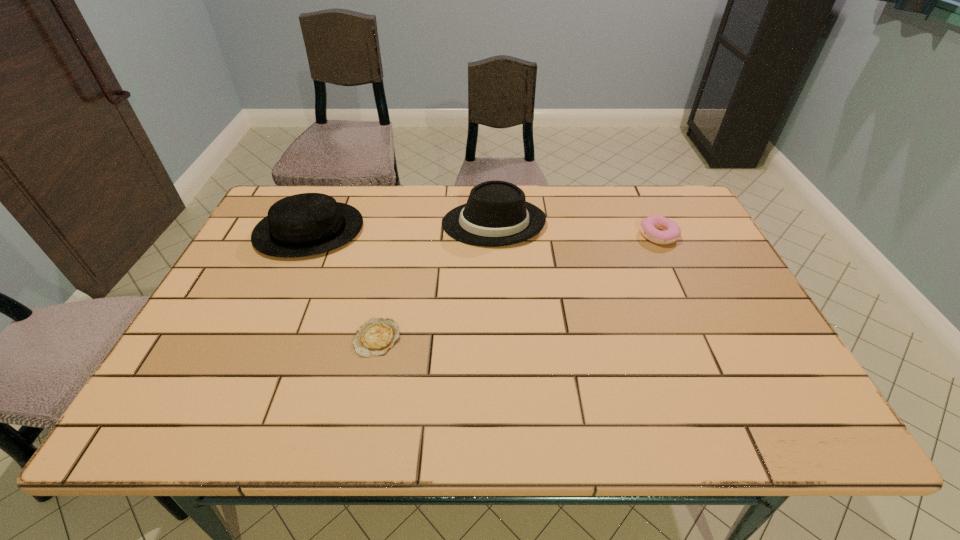
Where is `the second object from right to left`? the second object from right to left is located at coordinates (496, 214).

This screenshot has height=540, width=960. Identify the location of the right fedora. [x=496, y=214].

Where is `the left fedora`? the left fedora is located at coordinates (306, 224).

Image resolution: width=960 pixels, height=540 pixels. What are the coordinates of `the second tallest object` in the screenshot? It's located at (306, 224).

Find the location of a particular element. This screenshot has height=540, width=960. the third tallest object is located at coordinates (671, 232).

Image resolution: width=960 pixels, height=540 pixels. What are the coordinates of `pastry` in the screenshot? It's located at (671, 232).

The height and width of the screenshot is (540, 960). Find the location of `quiche`. quiche is located at coordinates (374, 338).

Locate an element on the screen. The width and height of the screenshot is (960, 540). the nearest object is located at coordinates click(374, 338).

Find the location of a particular element. The height and width of the screenshot is (540, 960). free spot located 0.070m on the front-facing side of the tallest object is located at coordinates click(x=419, y=223).

The width and height of the screenshot is (960, 540). Identify the location of vacant area situated 0.170m on the front-facing side of the tallest object. (386, 223).